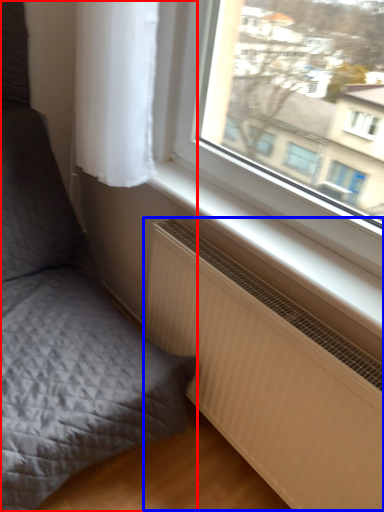
Question: Which of the following is the farthest to the observer, furniture (highlighted by a red box) or radiator (highlighted by a blue box)?

Choices:
 (A) furniture
 (B) radiator

Answer: (B)